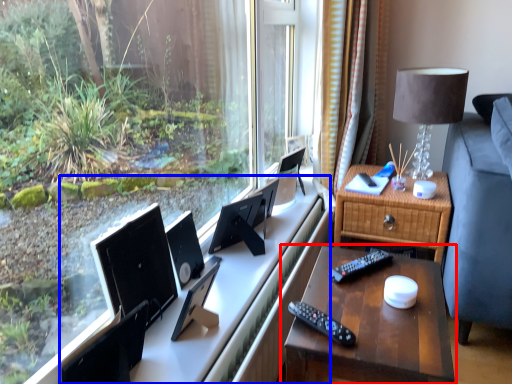
Question: Among these objects, which one is nearest to the camera, nightstand (highlighted by a red box) or computer desk (highlighted by a blue box)?

Choices:
 (A) nightstand
 (B) computer desk

Answer: (A)